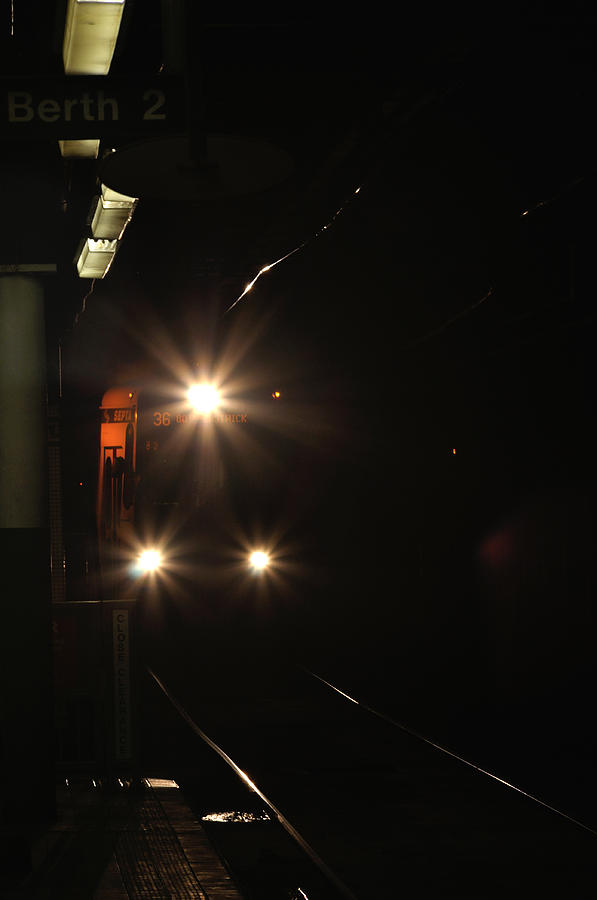
This screenshot has width=597, height=900. What are the coordinates of `small light` in the screenshot? It's located at (452, 450).